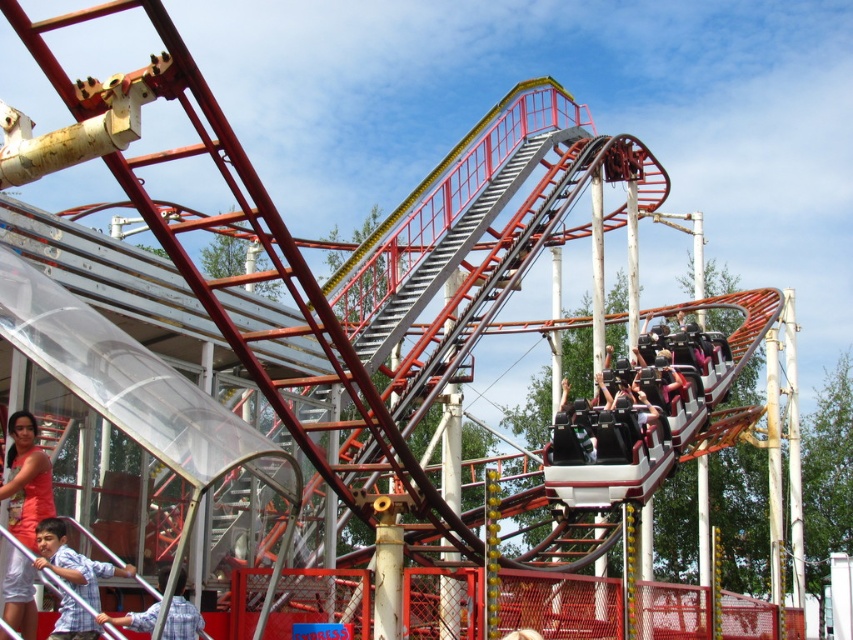
Does point (576, 474) come farther from viewer compared to point (108, 568)?

That is True.

Can you confirm if smooth brown roller coaster at center is positioned above light blue shirt at lower left?

Yes, smooth brown roller coaster at center is above light blue shirt at lower left.

Who is more forward, (595, 493) or (62, 630)?

Point (62, 630) is more forward.

Locate an element on the screen. smooth brown roller coaster at center is located at coordinates (654, 406).

What do you see at coordinates (26, 480) in the screenshot?
I see `matte red dress at lower left` at bounding box center [26, 480].

Who is higher up, matte red dress at lower left or light blue shirt at lower left?

Positioned higher is matte red dress at lower left.

Between point (25, 624) and point (86, 570), which one is positioned in front?

Point (25, 624) is in front.

Identify the location of matte red dress at lower left. The height and width of the screenshot is (640, 853). (26, 480).

Who is positioned more to the right, matte red dress at lower left or blue plaid shirt at lower left?

From the viewer's perspective, blue plaid shirt at lower left appears more on the right side.

Who is more distant from viewer, (x=15, y=460) or (x=177, y=582)?

Point (x=15, y=460)

Which is in front, point (41, 499) or point (160, 580)?

Positioned in front is point (41, 499).

Identify the location of matte red dress at lower left. The height and width of the screenshot is (640, 853). (26, 480).